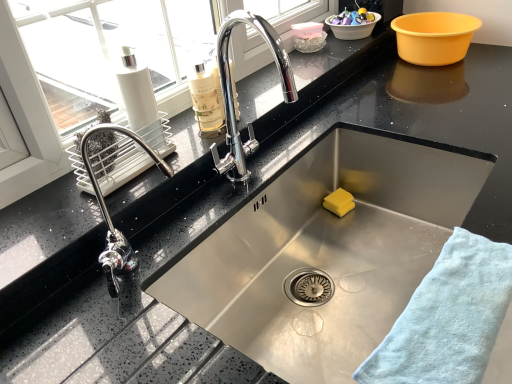
Question: Is yellow sponge at sink bottom taller or shorter than translucent plastic container at upper center, which is the 1th basin in left-to-right order?

Choices:
 (A) tall
 (B) short

Answer: (A)

Question: Is yellow sponge at sink bottom to the left or to the right of translucent plastic container at upper center, the third basin when ordered from right to left, in the image?

Choices:
 (A) left
 (B) right

Answer: (B)

Question: Based on their relative distances, which object is nearer to the yellow plastic basin at upper right, acting as the 3th basin starting from the left?

Choices:
 (A) white plastic basin at upper right, which ranks as the second basin in right-to-left order
 (B) yellow sponge at sink bottom
 (C) white matte bottle at upper left
 (D) light blue cotton towel at lower right
 (E) translucent plastic container at upper center, which is the 1th basin in left-to-right order

Answer: (A)

Question: Which of these objects is positioned closest to the white matte bottle at upper left?

Choices:
 (A) yellow plastic basin at upper right, which is counted as the 1th basin, starting from the right
 (B) white plastic basin at upper right, the second basin viewed from the left
 (C) yellow sponge at sink bottom
 (D) translucent plastic container at upper center, the third basin when ordered from right to left
 (E) light blue cotton towel at lower right

Answer: (C)